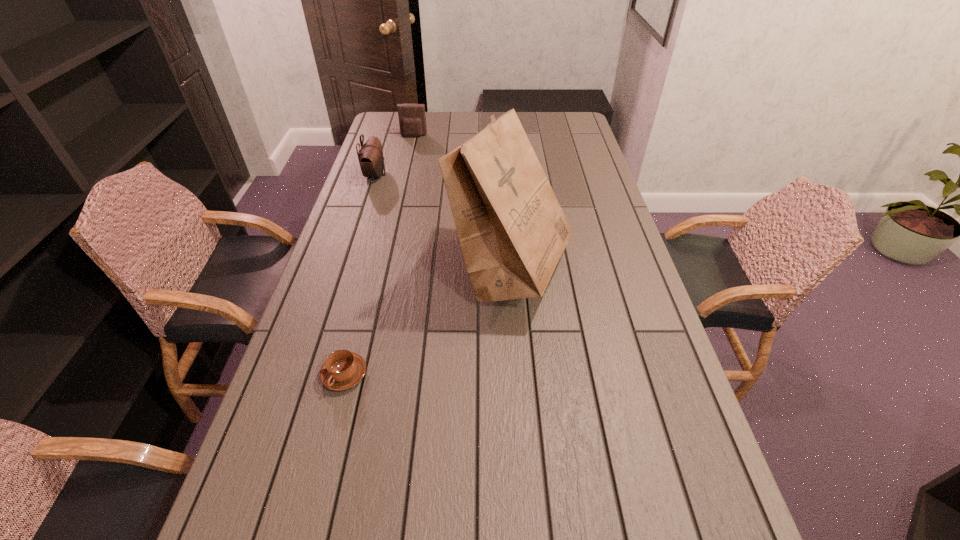
Where is `the rightmost object`? the rightmost object is located at coordinates (512, 230).

Locate an element on the screen. The height and width of the screenshot is (540, 960). grocery bag is located at coordinates 512,230.

Where is `the second farthest object`? This screenshot has width=960, height=540. the second farthest object is located at coordinates (370, 156).

Where is `the nearer pouch`? This screenshot has height=540, width=960. the nearer pouch is located at coordinates (370, 156).

Find the location of `the farthest object`. the farthest object is located at coordinates (412, 120).

Identify the location of the right pouch. (412, 120).

Locate an element on the screen. This screenshot has height=540, width=960. the nearest object is located at coordinates (342, 370).

Locate an element on the screen. the shortest object is located at coordinates (342, 370).

You are a GUI agent. You are given a task and a screenshot of the screen. Output one action in this format:
    pyautogui.click(x=<x>, y=<y>)
    Task: Click on the vacant space located 0.330m on the back of the grocery bag
    The height and width of the screenshot is (540, 960).
    Given the screenshot: What is the action you would take?
    pyautogui.click(x=504, y=172)

Find the location of a particular element. The image size is (960, 540). free location located 0.060m with the flap open on the third nearest object is located at coordinates (402, 175).